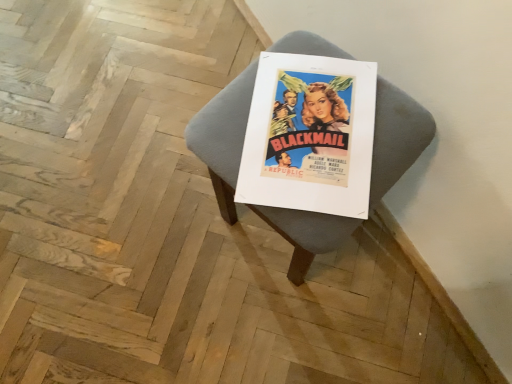
Question: From a real-world perspective, relative to matte paper poster at center, is matte gray cushion at center vertically above or below?

Choices:
 (A) above
 (B) below

Answer: (B)

Question: Is matte gray cushion at center inside or outside of matte paper poster at center?

Choices:
 (A) inside
 (B) outside

Answer: (B)

Question: Is point (431, 114) positioned closer to the camera than point (336, 96)?

Choices:
 (A) farther
 (B) closer

Answer: (A)

Question: Is matte paper poster at center wider or thinner than matte gray cushion at center?

Choices:
 (A) wide
 (B) thin

Answer: (B)

Question: Considering the positions of matte paper poster at center and matte gray cushion at center in the image, is matte paper poster at center bigger or smaller than matte gray cushion at center?

Choices:
 (A) big
 (B) small

Answer: (B)

Question: Is matte paper poster at center taller or shorter than matte gray cushion at center?

Choices:
 (A) tall
 (B) short

Answer: (B)

Question: In the image, is matte paper poster at center positioned in front of or behind matte gray cushion at center?

Choices:
 (A) behind
 (B) front

Answer: (A)